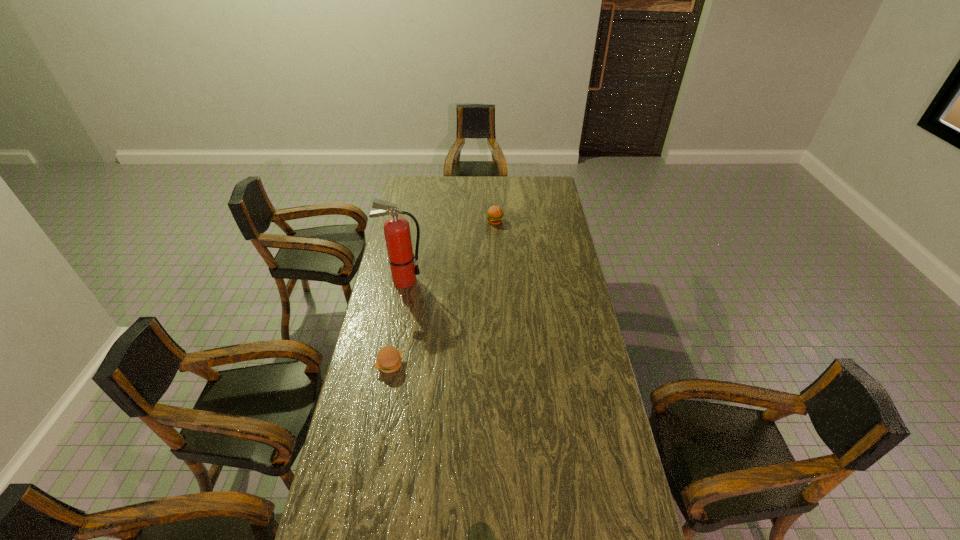
At what (x,y) coordinates should I click in order to perform the action: click on hamburger that is at the left edge. Please return your answer as a coordinate pair (x, y). Looking at the image, I should click on (388, 360).

Locate an element on the screen. Image resolution: width=960 pixels, height=540 pixels. vacant space at the far edge of the desktop is located at coordinates (489, 192).

Where is `vacant space at the left edge of the desktop`? This screenshot has height=540, width=960. vacant space at the left edge of the desktop is located at coordinates (350, 474).

You are a GUI agent. You are given a task and a screenshot of the screen. Output one action in this format:
    pyautogui.click(x=<x>, y=<y>)
    Task: Click on the vacant space at the right edge of the desktop
    
    Given the screenshot: What is the action you would take?
    pyautogui.click(x=560, y=235)

You are a GUI agent. You are given a task and a screenshot of the screen. Output one action in this format:
    pyautogui.click(x=<x>, y=<y>)
    Task: Click on the vacant space at the far right corner
    The height and width of the screenshot is (540, 960).
    Given the screenshot: What is the action you would take?
    pyautogui.click(x=539, y=189)

Locate an element on the screen. The height and width of the screenshot is (540, 960). free spot between the second nearest object and the farther hamburger is located at coordinates (449, 251).

I want to click on free space that is in between the farthest object and the tallest object, so click(449, 251).

This screenshot has width=960, height=540. In order to click on unoccupied position between the nearer hamburger and the rightmost object in this screenshot , I will do `click(443, 293)`.

Find the location of a particular element. vacant space that's between the tallest object and the right hamburger is located at coordinates (449, 251).

The image size is (960, 540). In order to click on free space that is in between the farthest object and the tallest object in this screenshot , I will do `click(449, 251)`.